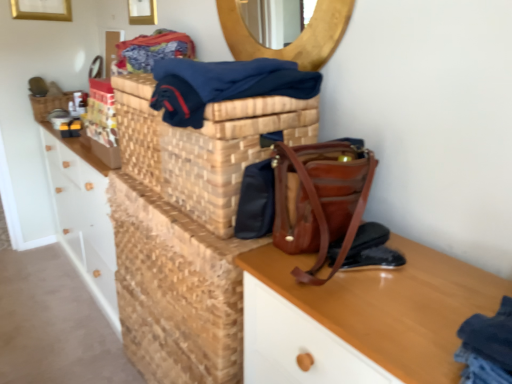
You are a GUI agent. You are given a task and a screenshot of the screen. Output one action in this format:
    pyautogui.click(x=<x>, y=<y>)
    Task: Click on the vacant region to the right of leather at center, the 1th shoe in the top-to-bottom sequence
    Image resolution: width=512 pixels, height=384 pixels.
    Given the screenshot: What is the action you would take?
    pyautogui.click(x=432, y=268)